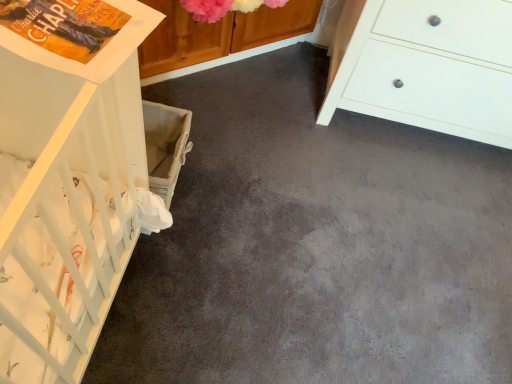
Identify the location of vacant area situated to the left side of white matte chest of drawers at upper right. This screenshot has width=512, height=384. (253, 107).